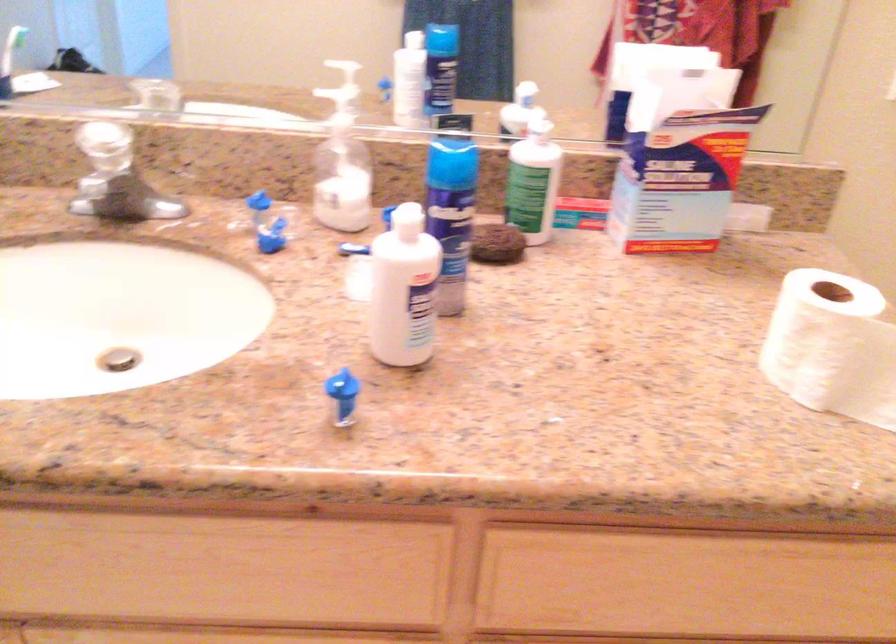
Identify the location of saline solution box. (679, 180).